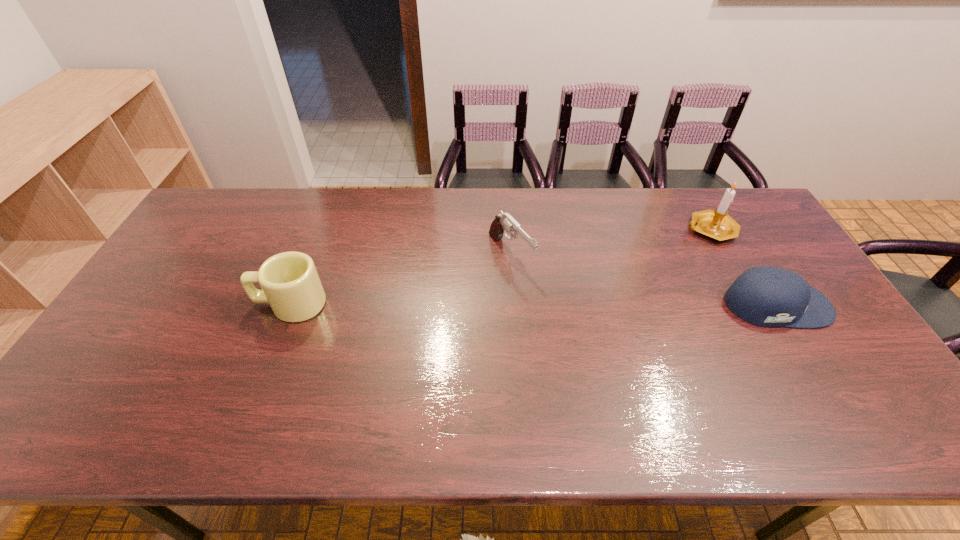
Where is `vacant space on the desktop that is between the mug and the shortest object and is positioned at the muzzle of the gun`? This screenshot has width=960, height=540. vacant space on the desktop that is between the mug and the shortest object and is positioned at the muzzle of the gun is located at coordinates (560, 305).

In order to click on free spot on the desktop that is between the leftmost object and the baseball cap and is positioned with a handle on the candle holder in this screenshot , I will do [603, 305].